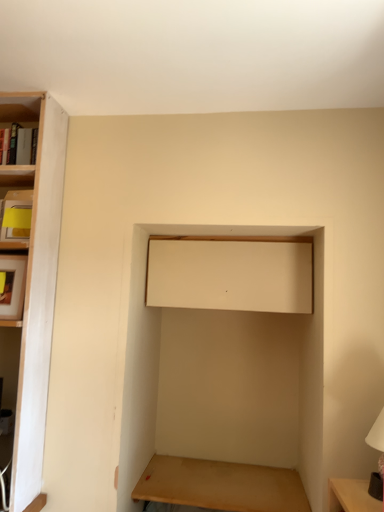
Locate an element on the screen. The height and width of the screenshot is (512, 384). empty space that is ontop of wooden table at lower center (from a real-world perspective) is located at coordinates (236, 477).